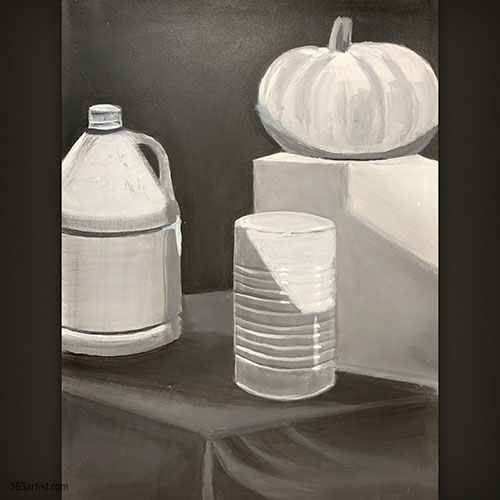
The width and height of the screenshot is (500, 500). Find the location of `table`. table is located at coordinates (236, 413).